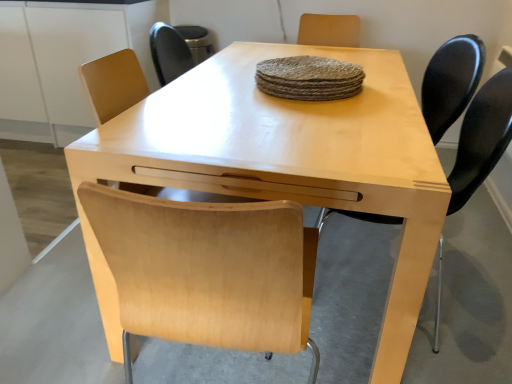
Identify the location of free space to the right of matte black chair at right, the first chair when ordered from back to front. The image size is (512, 384). (474, 246).